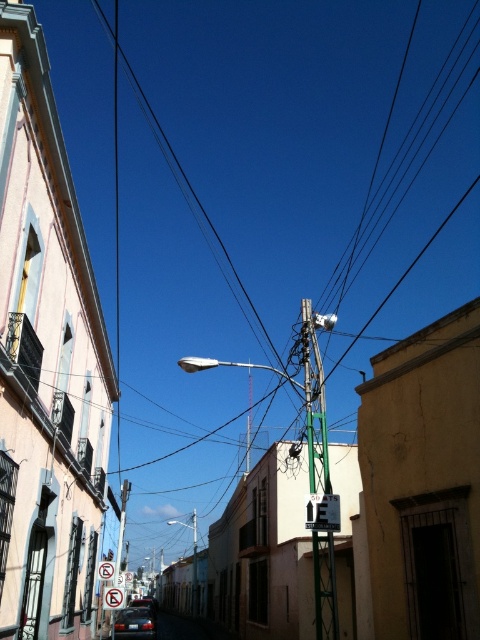
Who is higher up, shiny red car at center or metallic rectangular sign at center?

Positioned higher is metallic rectangular sign at center.

Which is behind, point (137, 636) or point (116, 592)?

The point (137, 636) is behind.

Is point (140, 612) positioned before point (109, 602)?

No, it is behind (109, 602).

Find the location of a particular element. shiny red car at center is located at coordinates (134, 624).

Is white plastic street sign at center taller than shiny red car at center?

Incorrect, white plastic street sign at center's height is not larger of shiny red car at center's.

Does white plastic street sign at center lie behind shiny red car at center?

That is False.

Who is more forward, (x=328, y=529) or (x=116, y=612)?

Positioned in front is point (x=328, y=529).

The width and height of the screenshot is (480, 640). Identify the location of white plastic street sign at center. (323, 513).

Is white plastic street sign at center positioned before shiny black car at lower center?

Yes, it is.

Which is in front, point (325, 529) or point (135, 605)?

Point (325, 529) is in front.

The width and height of the screenshot is (480, 640). Find the location of `white plastic street sign at center`. white plastic street sign at center is located at coordinates (323, 513).